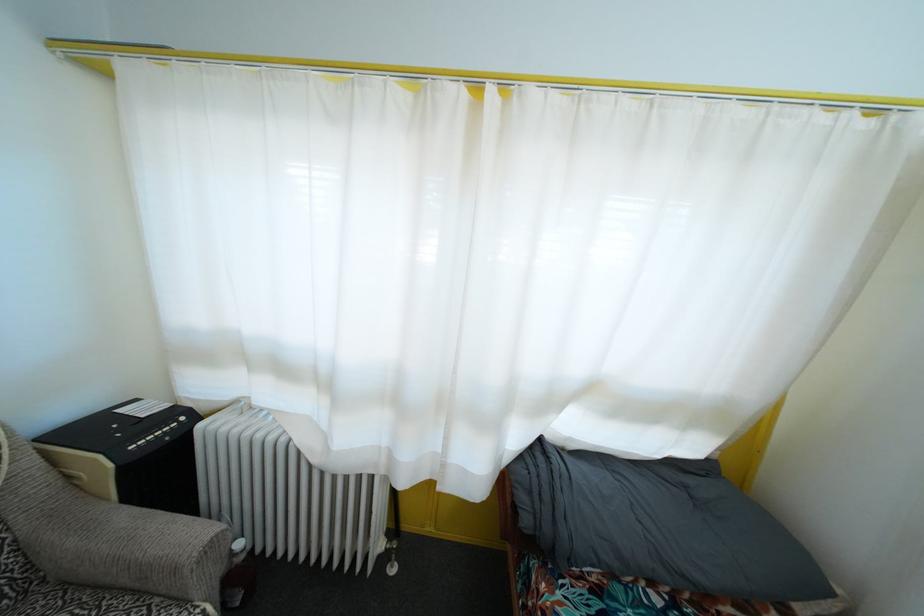
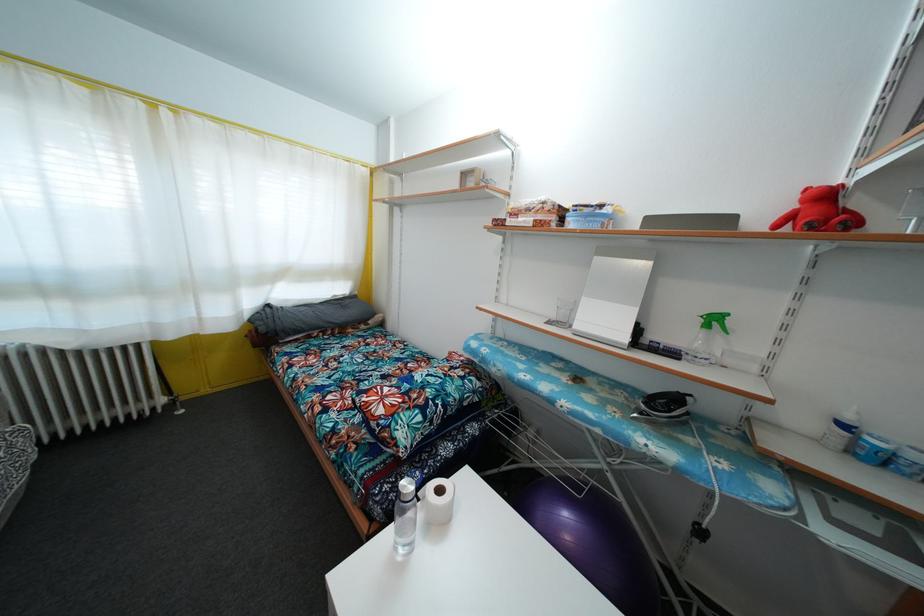
Find the pixel in the second image that matches the point at 720,463 in the first image.

(359, 300)